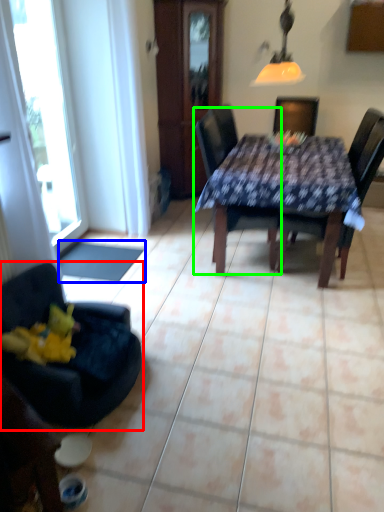
Question: Considering the real-world distances, which object is closest to chair (highlighted by a red box)? flat (highlighted by a blue box) or chair (highlighted by a green box).

Choices:
 (A) flat
 (B) chair

Answer: (A)